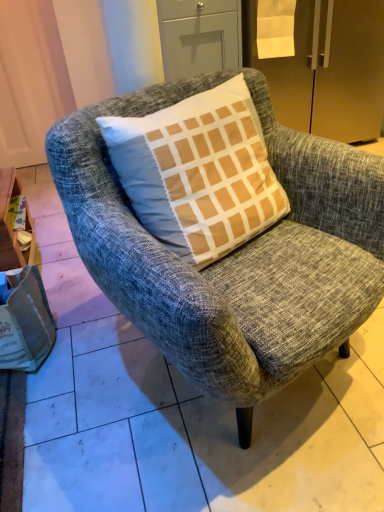
Question: Is matte gray drawer at upper center far away from textured gray armchair at center?

Choices:
 (A) yes
 (B) no

Answer: (A)

Question: Considering the relative positions of matte gray drawer at upper center and textured gray armchair at center in the image provided, is matte gray drawer at upper center to the right of textured gray armchair at center from the viewer's perspective?

Choices:
 (A) no
 (B) yes

Answer: (A)

Question: Can you confirm if matte gray drawer at upper center is wider than textured gray armchair at center?

Choices:
 (A) no
 (B) yes

Answer: (A)

Question: Considering the relative sizes of matte gray drawer at upper center and textured gray armchair at center in the image provided, is matte gray drawer at upper center shorter than textured gray armchair at center?

Choices:
 (A) no
 (B) yes

Answer: (B)

Question: Is matte gray drawer at upper center closer to camera compared to textured gray armchair at center?

Choices:
 (A) yes
 (B) no

Answer: (B)

Question: From the image's perspective, is white paper bag at lower left above or below satin gold refrigerator at upper right?

Choices:
 (A) below
 (B) above

Answer: (A)

Question: Looking at their shapes, would you say white paper bag at lower left is wider or thinner than satin gold refrigerator at upper right?

Choices:
 (A) wide
 (B) thin

Answer: (B)

Question: Is point (11, 351) closer or farther from the camera than point (377, 32)?

Choices:
 (A) closer
 (B) farther

Answer: (A)

Question: Considering the positions of white paper bag at lower left and satin gold refrigerator at upper right in the image, is white paper bag at lower left bigger or smaller than satin gold refrigerator at upper right?

Choices:
 (A) small
 (B) big

Answer: (A)

Question: Looking at the image, does white paper bag at lower left seem bigger or smaller compared to wooden at left?

Choices:
 (A) small
 (B) big

Answer: (A)

Question: Does point (31, 303) appear closer or farther from the camera than point (4, 200)?

Choices:
 (A) farther
 (B) closer

Answer: (B)

Question: From the image's perspective, is white paper bag at lower left located above or below wooden at left?

Choices:
 (A) above
 (B) below

Answer: (B)

Question: Is white paper bag at lower left wider or thinner than wooden at left?

Choices:
 (A) thin
 (B) wide

Answer: (B)

Question: From their relative heights in the image, would you say wooden at left is taller or shorter than textured gray armchair at center?

Choices:
 (A) tall
 (B) short

Answer: (B)

Question: In terms of width, does wooden at left look wider or thinner when compared to textured gray armchair at center?

Choices:
 (A) wide
 (B) thin

Answer: (B)